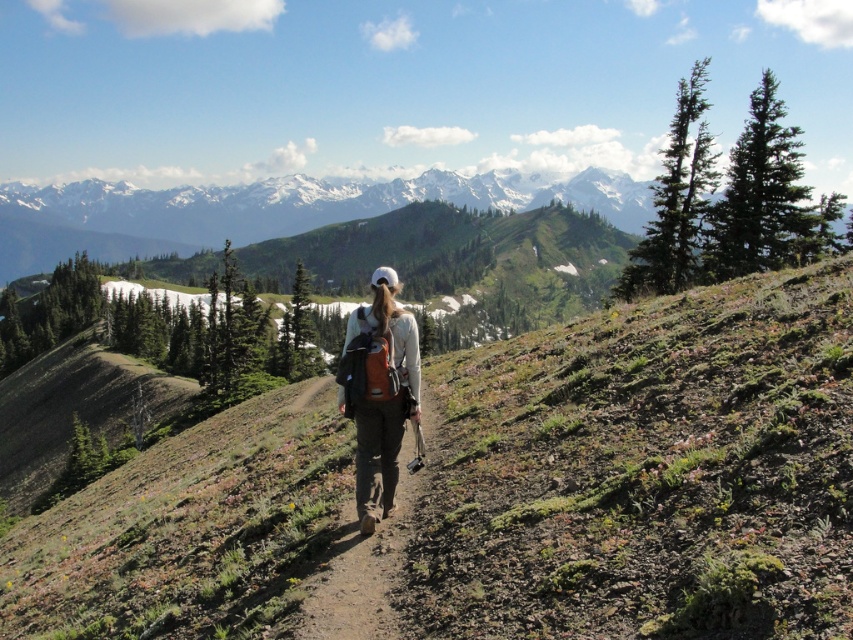
Question: Is white matte backpack at center to the left of brown fabric backpack at center from the viewer's perspective?

Choices:
 (A) yes
 (B) no

Answer: (A)

Question: From the image, what is the correct spatial relationship of white matte backpack at center in relation to brown fabric backpack at center?

Choices:
 (A) left
 (B) right

Answer: (A)

Question: Among these points, which one is nearest to the camera?

Choices:
 (A) (426, 429)
 (B) (378, 410)

Answer: (B)

Question: Which object appears farthest from the camera in this image?

Choices:
 (A) white matte backpack at center
 (B) brown fabric backpack at center

Answer: (A)

Question: Can you confirm if white matte backpack at center is positioned to the left of brown fabric backpack at center?

Choices:
 (A) yes
 (B) no

Answer: (A)